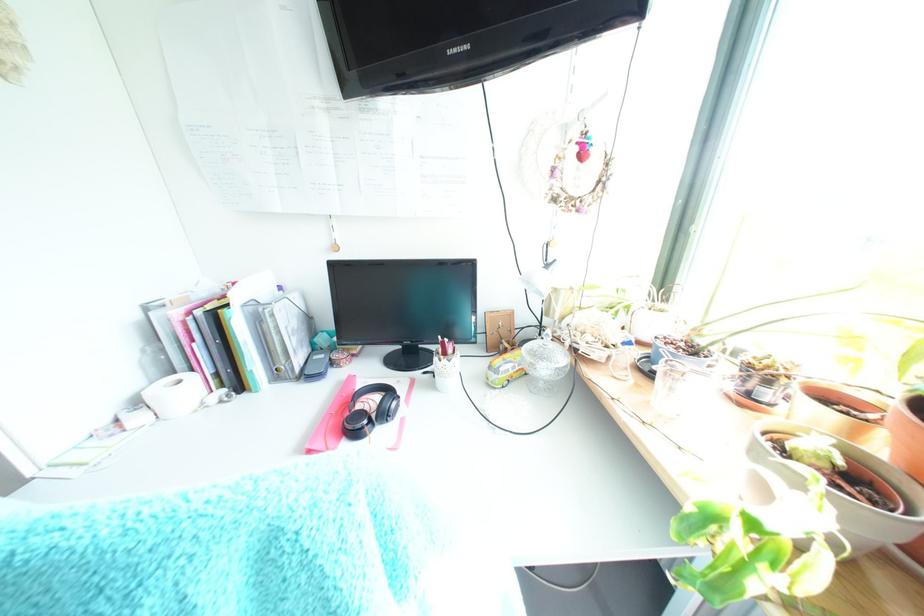
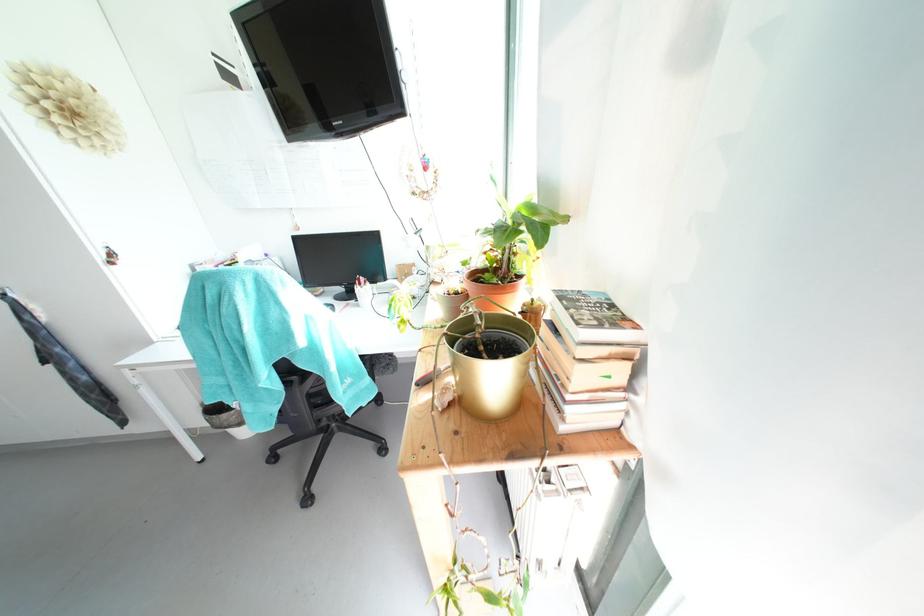
Question: Based on the continuous images, in which direction is the camera rotating? Reply with the corresponding letter.

Choices:
 (A) Left
 (B) Right
 (C) Up
 (D) Down

Answer: (D)